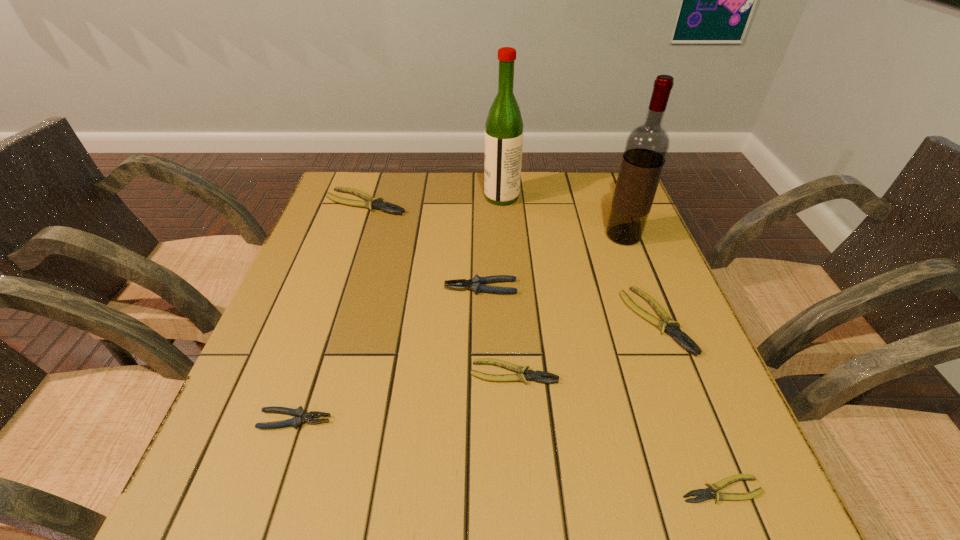
This screenshot has height=540, width=960. Identify the location of vacant space that satisfies the following two spatial constraints: 1. on the front side of the farthest pliers; 2. on the left side of the second smallest yellow pliers. (309, 373).

The height and width of the screenshot is (540, 960). In order to click on free point that satisfies the following two spatial constraints: 1. on the back side of the second biggest yellow pliers; 2. on the right side of the nearest yellow pliers in this screenshot , I will do `click(656, 321)`.

The height and width of the screenshot is (540, 960). I want to click on vacant point that satisfies the following two spatial constraints: 1. on the front side of the farthest pliers; 2. on the left side of the second farthest yellow pliers, so point(326,321).

The image size is (960, 540). I want to click on vacant space that satisfies the following two spatial constraints: 1. on the label of the liquor; 2. on the back side of the wine bottle, so click(x=504, y=236).

What are the coordinates of `free space that satisfies the following two spatial constraints: 1. on the front side of the second nearest yellow pliers; 2. at the gripping part of the smaller gray pliers` in the screenshot? It's located at (517, 420).